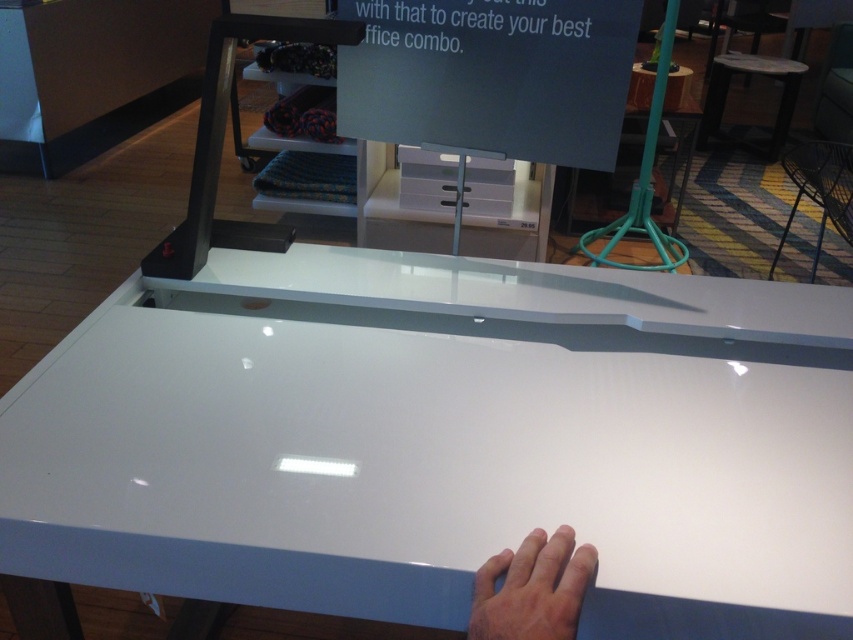
Question: Which of the following is the farthest from the observer?

Choices:
 (A) white glossy stool at upper right
 (B) skinny white hand at lower center

Answer: (A)

Question: Which of the following is the farthest from the observer?

Choices:
 (A) (776, 156)
 (B) (265, 454)

Answer: (A)

Question: Does skinny white hand at lower center appear on the right side of white glossy stool at upper right?

Choices:
 (A) yes
 (B) no

Answer: (B)

Question: Is white glossy table at center bigger than white glossy stool at upper right?

Choices:
 (A) yes
 (B) no

Answer: (B)

Question: Can you confirm if white glossy table at center is positioned to the right of white glossy stool at upper right?

Choices:
 (A) yes
 (B) no

Answer: (B)

Question: Which object is closer to the camera taking this photo?

Choices:
 (A) white glossy stool at upper right
 (B) white glossy table at center
 (C) skinny white hand at lower center

Answer: (C)